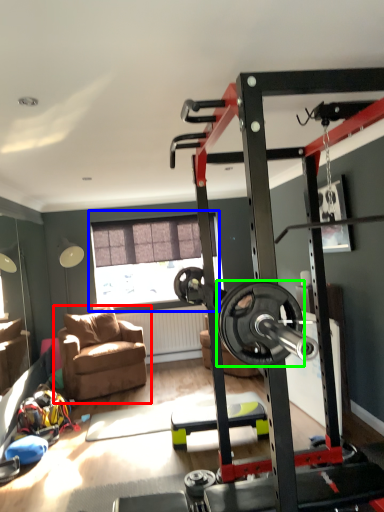
Question: Which object is positioned farthest from chair (highlighted by a red box)? Select from window (highlighted by a blue box) and wheel (highlighted by a green box).

Choices:
 (A) window
 (B) wheel

Answer: (B)